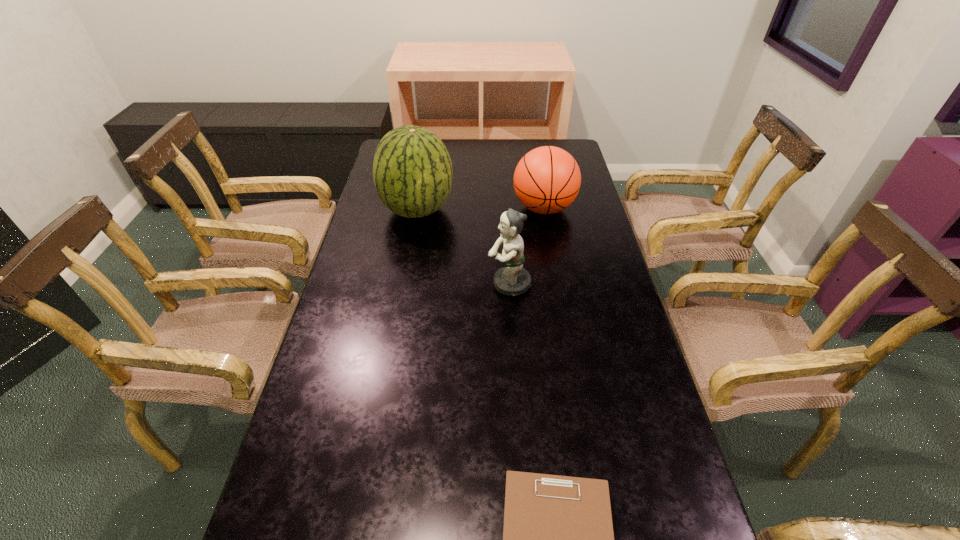
Identify which object is the second nearest to the tallest object. Please provide its 2D coordinates. Your answer should be formatted as a tuple, i.e. [(x, y)], where the tuple contains the x and y coordinates of a point satisfying the conditions above.

[(512, 279)]

Where is `the third closest object relative to the basketball`? the third closest object relative to the basketball is located at coordinates (558, 539).